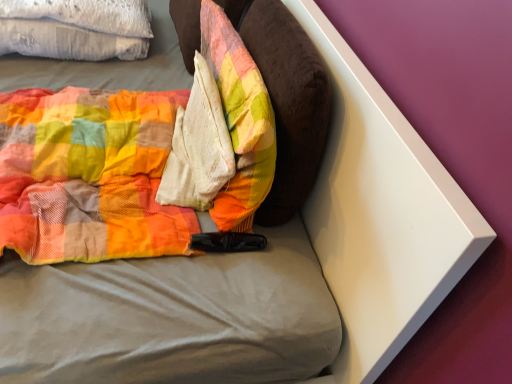
Question: Can you confirm if velvety brown pillow at center, marked as the 1th pillow in a right-to-left arrangement, is positioned to the left of white textured pillow at upper left?

Choices:
 (A) no
 (B) yes

Answer: (A)

Question: From the image's perspective, is velvety brown pillow at center, marked as the 1th pillow in a right-to-left arrangement, on top of white textured pillow at upper left?

Choices:
 (A) yes
 (B) no

Answer: (B)

Question: Is velvety brown pillow at center, marked as the 1th pillow in a right-to-left arrangement, aimed at white textured pillow at upper left?

Choices:
 (A) no
 (B) yes

Answer: (A)

Question: Is velvety brown pillow at center, marked as the 1th pillow in a right-to-left arrangement, to the right of white textured pillow at upper left from the viewer's perspective?

Choices:
 (A) yes
 (B) no

Answer: (A)

Question: Is velvety brown pillow at center, marked as the 1th pillow in a right-to-left arrangement, bigger than white textured pillow at upper left?

Choices:
 (A) yes
 (B) no

Answer: (B)

Question: Is velvety brown pillow at center, marked as the 1th pillow in a right-to-left arrangement, next to white textured pillow at upper left and touching it?

Choices:
 (A) no
 (B) yes

Answer: (A)

Question: Can you confirm if plush fabric pillow at center, which is counted as the first pillow, starting from the left, is bigger than velvety brown pillow at center, marked as the 1th pillow in a right-to-left arrangement?

Choices:
 (A) yes
 (B) no

Answer: (B)

Question: Does plush fabric pillow at center, which is counted as the first pillow, starting from the left, have a smaller size compared to velvety brown pillow at center, the 2th pillow in the left-to-right sequence?

Choices:
 (A) yes
 (B) no

Answer: (A)

Question: Is plush fabric pillow at center, which is counted as the first pillow, starting from the left, next to velvety brown pillow at center, marked as the 1th pillow in a right-to-left arrangement?

Choices:
 (A) yes
 (B) no

Answer: (A)

Question: Does plush fabric pillow at center, which is counted as the first pillow, starting from the left, turn towards velvety brown pillow at center, the 2th pillow in the left-to-right sequence?

Choices:
 (A) yes
 (B) no

Answer: (A)

Question: From a real-world perspective, is plush fabric pillow at center, placed as the 2th pillow when sorted from right to left, located beneath velvety brown pillow at center, marked as the 1th pillow in a right-to-left arrangement?

Choices:
 (A) no
 (B) yes

Answer: (B)

Question: Considering the relative positions of plush fabric pillow at center, which is counted as the first pillow, starting from the left, and velvety brown pillow at center, marked as the 1th pillow in a right-to-left arrangement, in the image provided, is plush fabric pillow at center, which is counted as the first pillow, starting from the left, to the left of velvety brown pillow at center, marked as the 1th pillow in a right-to-left arrangement, from the viewer's perspective?

Choices:
 (A) yes
 (B) no

Answer: (A)

Question: From a real-world perspective, is white textured pillow at upper left beneath white textured pillow at center?

Choices:
 (A) no
 (B) yes

Answer: (B)